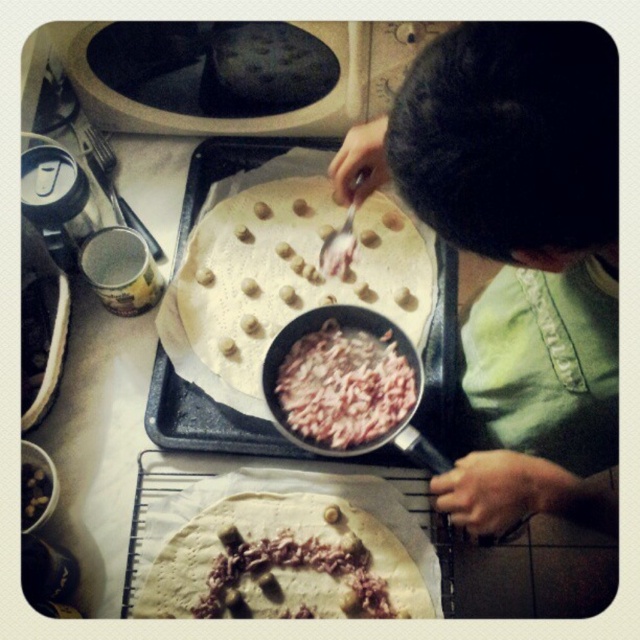
You are a chef preparing a dish and need to layer ingredients. You have a shiny pink meat at center and dark brown textured nuts at lower left. Which ingredient is taller when placed on the baking tray?

The shiny pink meat at center is taller than the dark brown textured nuts at lower left when placed on the baking tray.

In the scene shown: You are a chef preparing a dish and you have two shiny pink shredded meat at center and shiny pink meat at center on the counter. Which one is closer to you?

Both the shiny pink shredded meat at center and the shiny pink meat at center are the same object, so there is no difference in distance.

You are a delivery robot with a height of 1.2 meters. You need to deliver a package to the point marked at coordinates (x=198, y=326). Can you reach that point without bending down?

The point at coordinates (x=198, y=326) is 1.02 meters from the camera, so the robot can reach it without bending down since its height is 1.2 meters, which is taller than the point.